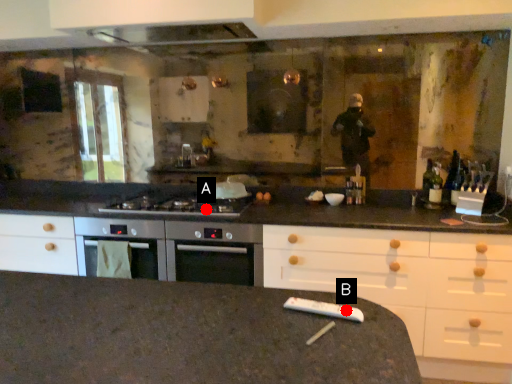
Question: Two points are circled on the image, labeled by A and B beside each circle. Which point appears closest to the camera in this image?

Choices:
 (A) A is closer
 (B) B is closer

Answer: (B)